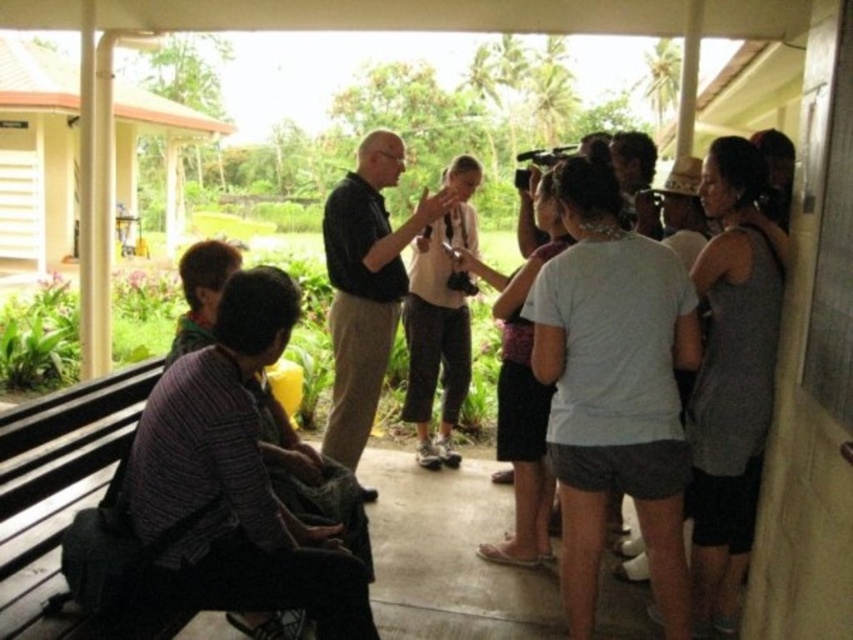
Does point (135, 410) lie behind point (346, 246)?

No, it is not.

The image size is (853, 640). Describe the element at coordinates (56, 484) in the screenshot. I see `wooden bench at lower left` at that location.

This screenshot has width=853, height=640. I want to click on wooden bench at lower left, so tap(56, 484).